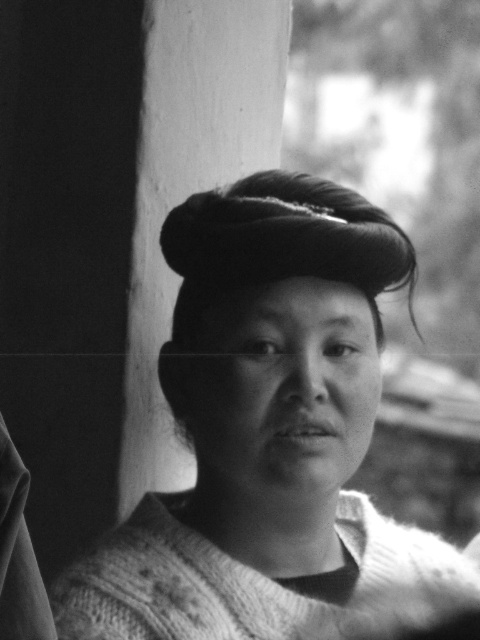
Question: Is knitted sweater at center above dark matte hair bun at center?

Choices:
 (A) no
 (B) yes

Answer: (A)

Question: Is knitted sweater at center to the right of dark matte hair bun at center from the viewer's perspective?

Choices:
 (A) yes
 (B) no

Answer: (A)

Question: Which point is farther from the camera taking this photo?

Choices:
 (A) tap(231, 189)
 (B) tap(256, 448)

Answer: (A)

Question: Is knitted sweater at center closer to the viewer compared to dark matte hair bun at center?

Choices:
 (A) no
 (B) yes

Answer: (B)

Question: Which point is closer to the camera?

Choices:
 (A) dark matte hair bun at center
 (B) knitted sweater at center

Answer: (B)